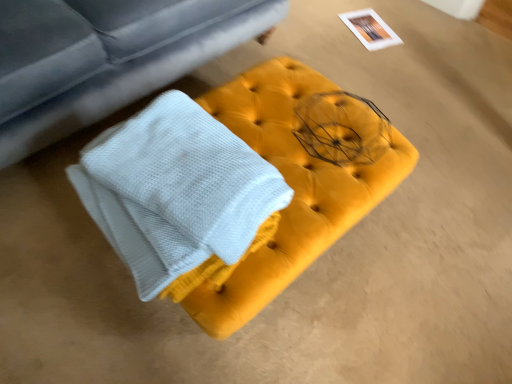
Question: From the image's perspective, is matte gray studio couch at upper left above velvet yellow ottoman at center?

Choices:
 (A) yes
 (B) no

Answer: (A)

Question: Does matte gray studio couch at upper left have a greater height compared to velvet yellow ottoman at center?

Choices:
 (A) yes
 (B) no

Answer: (A)

Question: Is the depth of matte gray studio couch at upper left less than that of velvet yellow ottoman at center?

Choices:
 (A) yes
 (B) no

Answer: (A)

Question: From a real-world perspective, is matte gray studio couch at upper left under velvet yellow ottoman at center?

Choices:
 (A) yes
 (B) no

Answer: (B)

Question: Could you tell me if matte gray studio couch at upper left is turned towards velvet yellow ottoman at center?

Choices:
 (A) yes
 (B) no

Answer: (A)

Question: Can you confirm if matte gray studio couch at upper left is bigger than velvet yellow ottoman at center?

Choices:
 (A) no
 (B) yes

Answer: (B)

Question: From the image's perspective, is velvet yellow ottoman at center located beneath matte gray studio couch at upper left?

Choices:
 (A) yes
 (B) no

Answer: (A)

Question: Would you say velvet yellow ottoman at center is a long distance from matte gray studio couch at upper left?

Choices:
 (A) yes
 (B) no

Answer: (B)

Question: Does velvet yellow ottoman at center have a greater width compared to matte gray studio couch at upper left?

Choices:
 (A) no
 (B) yes

Answer: (A)

Question: From the image's perspective, is velvet yellow ottoman at center on top of matte gray studio couch at upper left?

Choices:
 (A) no
 (B) yes

Answer: (A)

Question: Can you confirm if velvet yellow ottoman at center is positioned to the left of matte gray studio couch at upper left?

Choices:
 (A) yes
 (B) no

Answer: (B)

Question: Considering the relative sizes of velvet yellow ottoman at center and matte gray studio couch at upper left in the image provided, is velvet yellow ottoman at center bigger than matte gray studio couch at upper left?

Choices:
 (A) yes
 (B) no

Answer: (B)

Question: In the image, is velvet yellow ottoman at center positioned in front of or behind matte gray studio couch at upper left?

Choices:
 (A) front
 (B) behind

Answer: (B)